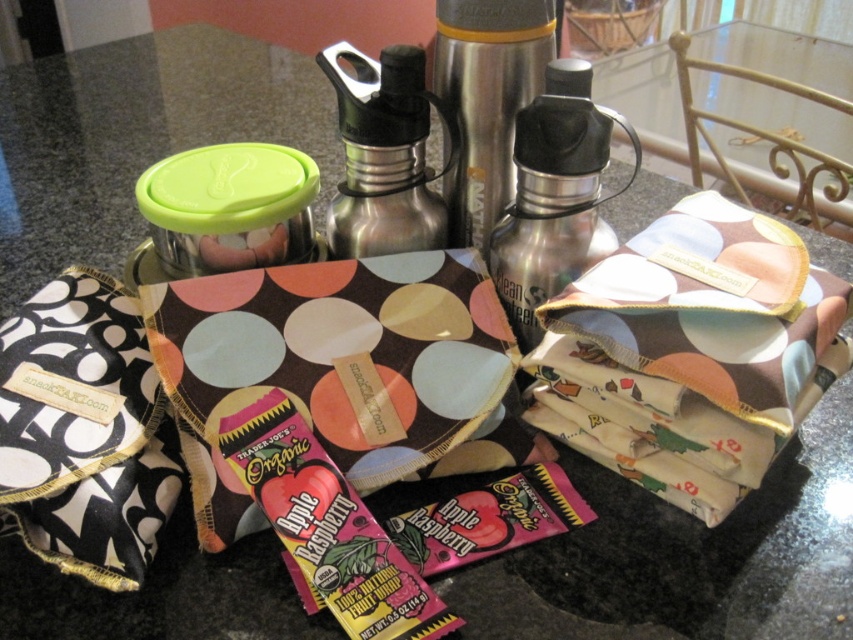
Question: Which point is farther to the camera?

Choices:
 (A) (514, 307)
 (B) (387, 248)
 (C) (764, 432)

Answer: (B)

Question: In this image, where is silver metallic thermos at center located relative to stainless steel thermos at center?

Choices:
 (A) below
 (B) above

Answer: (A)

Question: Which of the following is the farthest from the observer?

Choices:
 (A) stainless steel thermos at center
 (B) silver metallic thermos at center
 (C) brown fabric pouch at center

Answer: (B)

Question: Does brown fabric pouch at center appear on the right side of stainless steel thermos at center?

Choices:
 (A) no
 (B) yes

Answer: (B)

Question: Can you confirm if brown fabric pouch at center is positioned above shiny metallic water bottle at center?

Choices:
 (A) no
 (B) yes

Answer: (A)

Question: Among these points, which one is nearest to the camera?

Choices:
 (A) (436, 4)
 (B) (624, 353)

Answer: (B)